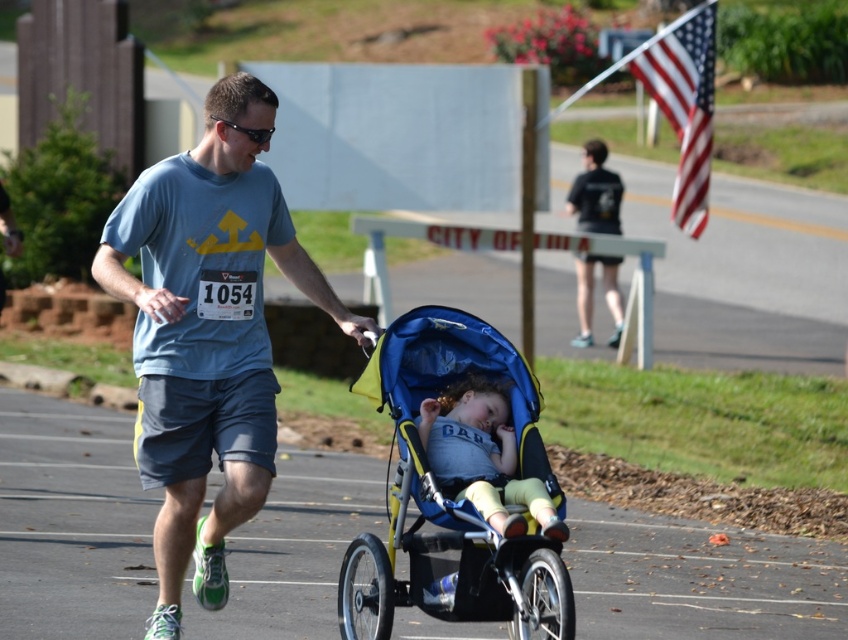
Question: Which object is the closest to the black matte shirt at upper center?

Choices:
 (A) light blue fabric baby at center
 (B) blue cotton shirt at center

Answer: (A)

Question: Which point appears closest to the camera in this image?

Choices:
 (A) (593, 193)
 (B) (382, 401)
 (C) (151, 269)
 (D) (488, 461)

Answer: (B)

Question: Among these objects, which one is nearest to the camera?

Choices:
 (A) blue cotton shirt at center
 (B) blue/yellow fabric stroller at center
 (C) light blue fabric baby at center
 (D) black matte shirt at upper center

Answer: (B)

Question: Considering the relative positions of blue cotton shirt at center and light blue fabric baby at center in the image provided, where is blue cotton shirt at center located with respect to light blue fabric baby at center?

Choices:
 (A) above
 (B) below

Answer: (A)

Question: Is blue/yellow fabric stroller at center smaller than black matte shirt at upper center?

Choices:
 (A) no
 (B) yes

Answer: (A)

Question: Does blue/yellow fabric stroller at center appear on the right side of light blue fabric baby at center?

Choices:
 (A) yes
 (B) no

Answer: (B)